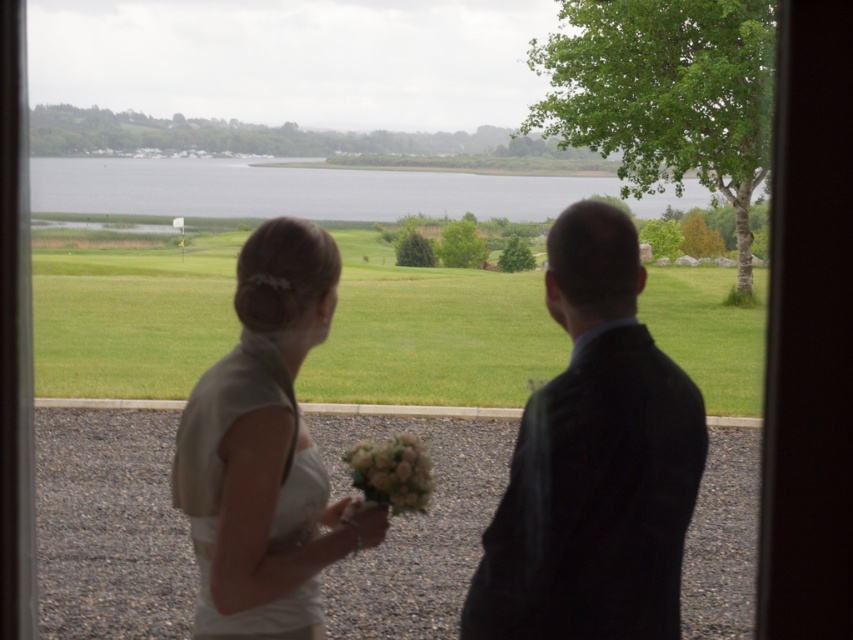
You are a photographer positioned inside a building looking through the window. You notice the dark suit at center and the white satin dress at left in the scene. Which of the two is closer to the window based on their positions?

The dark suit at center is closer to the window than the white satin dress at left because it is positioned in front of it.

You are standing inside a building looking through the window. You see the green grassy field at center and the dark suit at center. Which one is closer to the window?

The dark suit at center is closer to the window because it is located below the green grassy field at center, which is positioned above it.

You are standing inside a building looking through the window. You see two points marked on the window glass. The first point is at coordinates point (x=485, y=289) and the second point is at point (x=601, y=177). Which of these points is closer to you?

Point (x=485, y=289) is closer to the viewer than point (x=601, y=177).